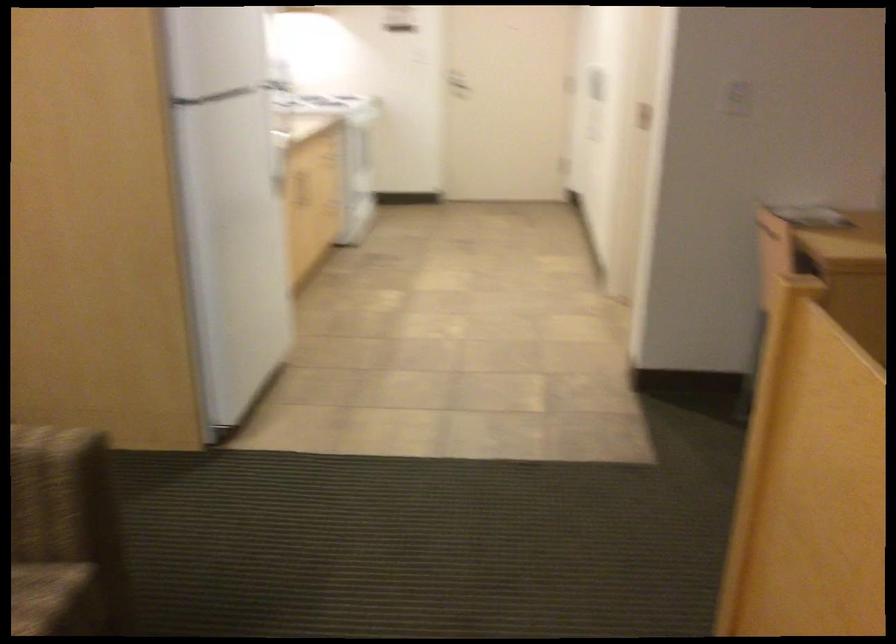
Where would you turn the door handle? Please return your answer as a coordinate pair (x, y).

(455, 84)